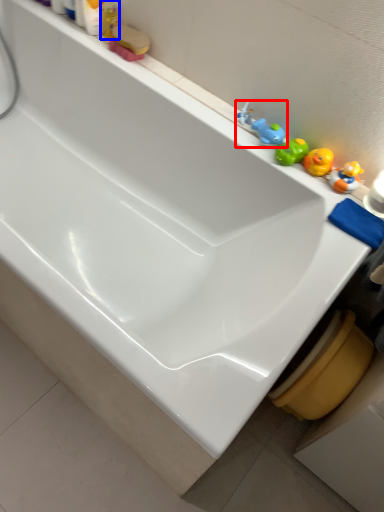
Question: Among these objects, which one is farthest to the camera, toy (highlighted by a red box) or toiletry (highlighted by a blue box)?

Choices:
 (A) toy
 (B) toiletry

Answer: (B)